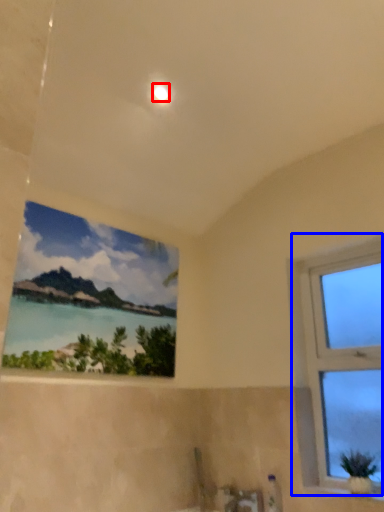
Question: Which object is closer to the camera taking this photo, light (highlighted by a red box) or window (highlighted by a blue box)?

Choices:
 (A) light
 (B) window

Answer: (B)